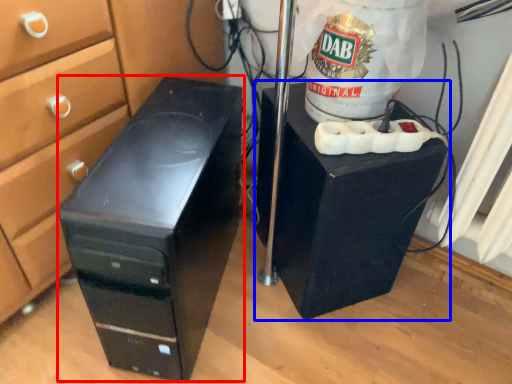
Question: Which object appears closest to the camera in this image, furniture (highlighted by a red box) or furniture (highlighted by a blue box)?

Choices:
 (A) furniture
 (B) furniture

Answer: (A)